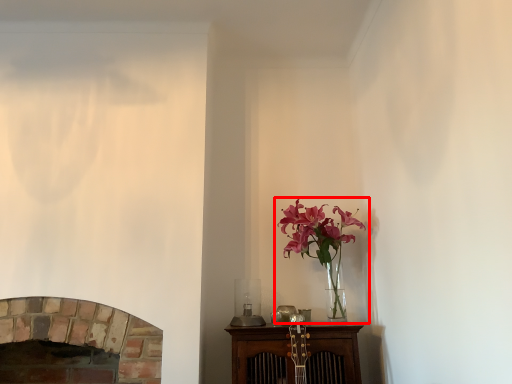
Question: From the image's perspective, where is houseplant (annotated by the red box) located in relation to fireplace in the image?

Choices:
 (A) below
 (B) above

Answer: (B)